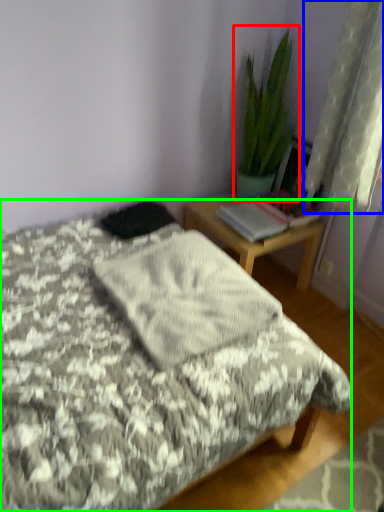
Question: Based on their relative distances, which object is nearer to houseplant (highlighted by a red box)? Choose from curtain (highlighted by a blue box) and bed (highlighted by a green box).

Choices:
 (A) curtain
 (B) bed

Answer: (A)